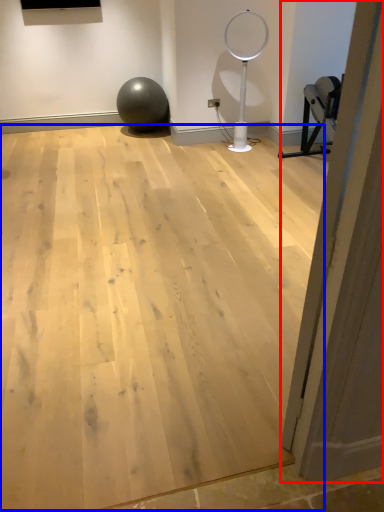
Question: Which object appears closest to the camera in this image, door (highlighted by a red box) or plywood (highlighted by a blue box)?

Choices:
 (A) door
 (B) plywood

Answer: (A)